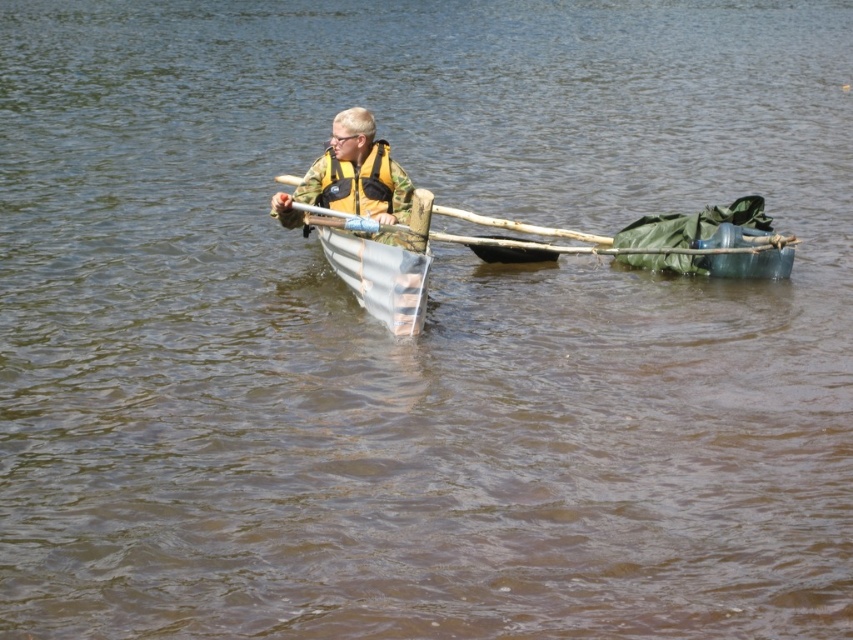
Question: Which point appears closest to the camera in this image?

Choices:
 (A) (335, 168)
 (B) (376, 204)

Answer: (B)

Question: Among these points, which one is farthest from the camera?

Choices:
 (A) (390, 205)
 (B) (331, 131)

Answer: (B)

Question: Is the position of camouflage fabric jacket at center less distant than that of yellow fabric life jacket at center?

Choices:
 (A) yes
 (B) no

Answer: (A)

Question: Can you confirm if camouflage fabric jacket at center is positioned to the left of yellow fabric life jacket at center?

Choices:
 (A) no
 (B) yes

Answer: (A)

Question: Can you confirm if camouflage fabric jacket at center is bigger than yellow fabric life jacket at center?

Choices:
 (A) yes
 (B) no

Answer: (A)